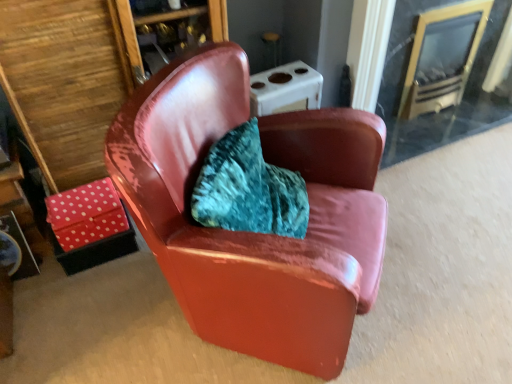
Question: Is clear glass fireplace at upper right positioned far away from polka dot fabric table at lower left?

Choices:
 (A) no
 (B) yes

Answer: (B)

Question: Can you confirm if clear glass fireplace at upper right is positioned to the left of polka dot fabric table at lower left?

Choices:
 (A) yes
 (B) no

Answer: (B)

Question: Is clear glass fireplace at upper right wider than polka dot fabric table at lower left?

Choices:
 (A) no
 (B) yes

Answer: (B)

Question: Is clear glass fireplace at upper right in front of polka dot fabric table at lower left?

Choices:
 (A) no
 (B) yes

Answer: (A)

Question: Is clear glass fireplace at upper right to the right of polka dot fabric table at lower left from the viewer's perspective?

Choices:
 (A) no
 (B) yes

Answer: (B)

Question: From the image's perspective, is clear glass fireplace at upper right positioned above or below polka dot fabric table at lower left?

Choices:
 (A) above
 (B) below

Answer: (A)

Question: Based on their positions, is clear glass fireplace at upper right located to the left or right of polka dot fabric table at lower left?

Choices:
 (A) left
 (B) right

Answer: (B)

Question: From a real-world perspective, is clear glass fireplace at upper right above or below polka dot fabric table at lower left?

Choices:
 (A) below
 (B) above

Answer: (B)

Question: Would you say clear glass fireplace at upper right is inside or outside polka dot fabric table at lower left?

Choices:
 (A) outside
 (B) inside

Answer: (A)

Question: Which is correct: polka dot fabric table at lower left is inside glossy leather chair at center, or outside of it?

Choices:
 (A) inside
 (B) outside

Answer: (B)

Question: In the image, is polka dot fabric table at lower left positioned in front of or behind glossy leather chair at center?

Choices:
 (A) behind
 (B) front

Answer: (A)

Question: Based on their sizes in the image, would you say polka dot fabric table at lower left is bigger or smaller than glossy leather chair at center?

Choices:
 (A) big
 (B) small

Answer: (B)

Question: Considering the positions of polka dot fabric table at lower left and glossy leather chair at center in the image, is polka dot fabric table at lower left wider or thinner than glossy leather chair at center?

Choices:
 (A) wide
 (B) thin

Answer: (B)

Question: From the image's perspective, is clear glass fireplace at upper right above or below glossy leather chair at center?

Choices:
 (A) above
 (B) below

Answer: (A)

Question: Is point (479, 114) closer or farther from the camera than point (333, 249)?

Choices:
 (A) closer
 (B) farther

Answer: (B)